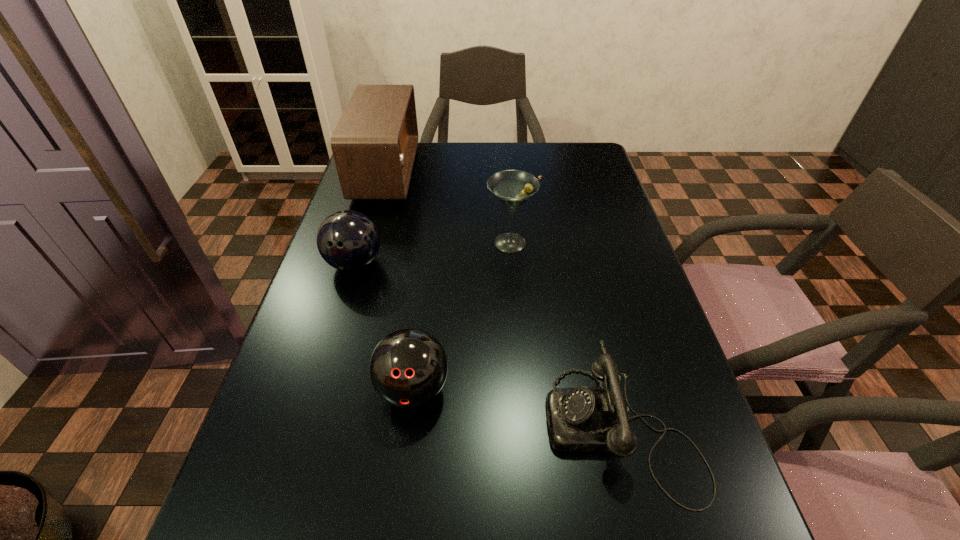
Identify the location of free region at the right edge of the desktop. (630, 475).

In order to click on unoccupied position between the farthest object and the left bowling ball in this screenshot , I will do tap(371, 218).

Find the location of a particular element. free space between the farthest object and the right bowling ball is located at coordinates (399, 280).

The width and height of the screenshot is (960, 540). Find the location of `vacant region between the radio receiver and the shortest object`. vacant region between the radio receiver and the shortest object is located at coordinates (504, 300).

At what (x,y) coordinates should I click in order to perform the action: click on vacant space that's between the right bowling ball and the telephone. Please return your answer as a coordinate pair (x, y). Looking at the image, I should click on (517, 408).

At what (x,y) coordinates should I click in order to perform the action: click on vacant area that lies between the right bowling ball and the left bowling ball. Please return your answer as a coordinate pair (x, y). This screenshot has width=960, height=540. Looking at the image, I should click on (384, 326).

Find the location of `vacant space in between the farthest object and the farther bowling ball`. vacant space in between the farthest object and the farther bowling ball is located at coordinates (371, 218).

Image resolution: width=960 pixels, height=540 pixels. Find the location of `empty location between the martini and the shortest object`. empty location between the martini and the shortest object is located at coordinates tap(565, 335).

Locate an element on the screen. This screenshot has height=540, width=960. free space that is in between the radio receiver and the left bowling ball is located at coordinates (371, 218).

The width and height of the screenshot is (960, 540). Identify the location of unoccupied position between the shortest object and the right bowling ball. pyautogui.click(x=517, y=408).